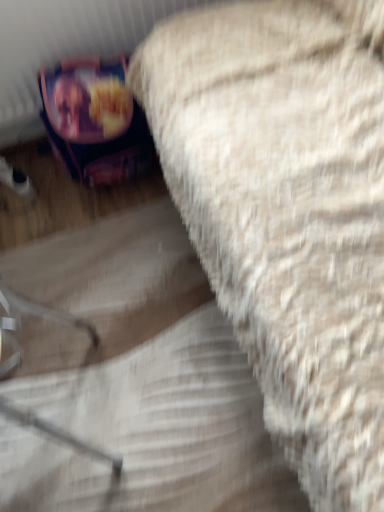
Measure the distance between point (143, 148) and camera.

They are 4.52 feet apart.

At what (x,y) coordinates should I click in order to perform the action: click on matte purple baby carriage at lower left. Please return your answer as a coordinate pair (x, y). This screenshot has height=512, width=384. Looking at the image, I should click on (95, 121).

The image size is (384, 512). Describe the element at coordinates (95, 121) in the screenshot. I see `matte purple baby carriage at lower left` at that location.

Where is `matte purple baby carriage at lower left`? This screenshot has height=512, width=384. matte purple baby carriage at lower left is located at coordinates (95, 121).